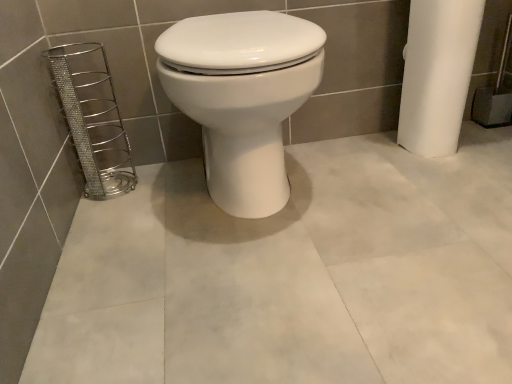
Image resolution: width=512 pixels, height=384 pixels. Find the location of `free spot below silver metallic wire basket at left (from a real-world perspective)`. free spot below silver metallic wire basket at left (from a real-world perspective) is located at coordinates (121, 180).